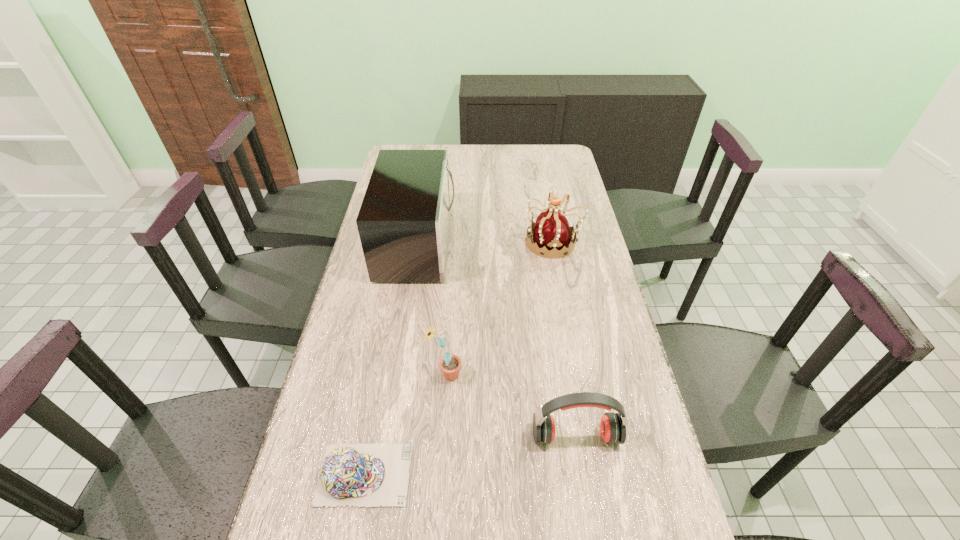
Where is `vacant space that satisfies the following two spatial constraints: 1. on the front-facing side of the tiara; 2. on the ear cups of the earphone`? vacant space that satisfies the following two spatial constraints: 1. on the front-facing side of the tiara; 2. on the ear cups of the earphone is located at coordinates (589, 436).